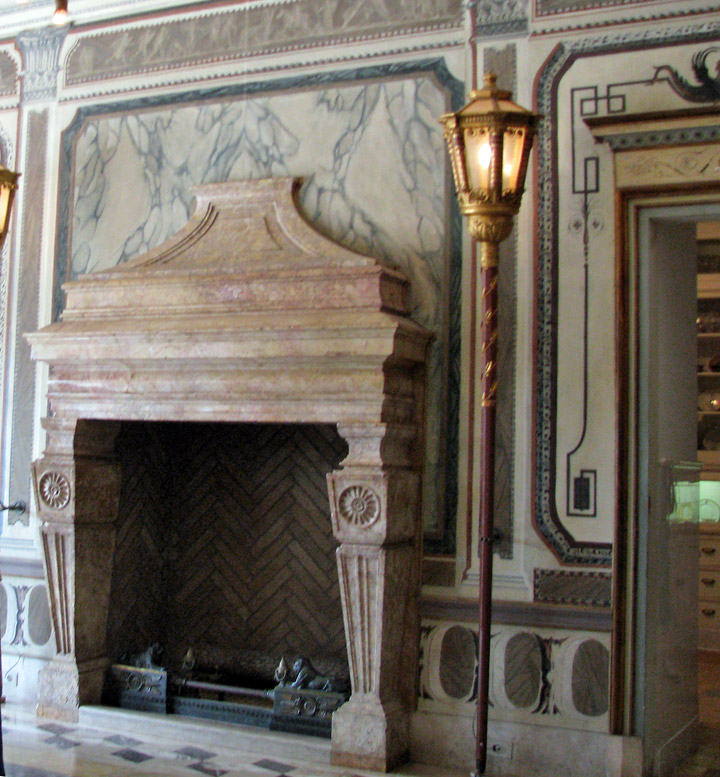
Locate an element on the screen. Image resolution: width=720 pixels, height=777 pixels. hearth is located at coordinates (127, 760).